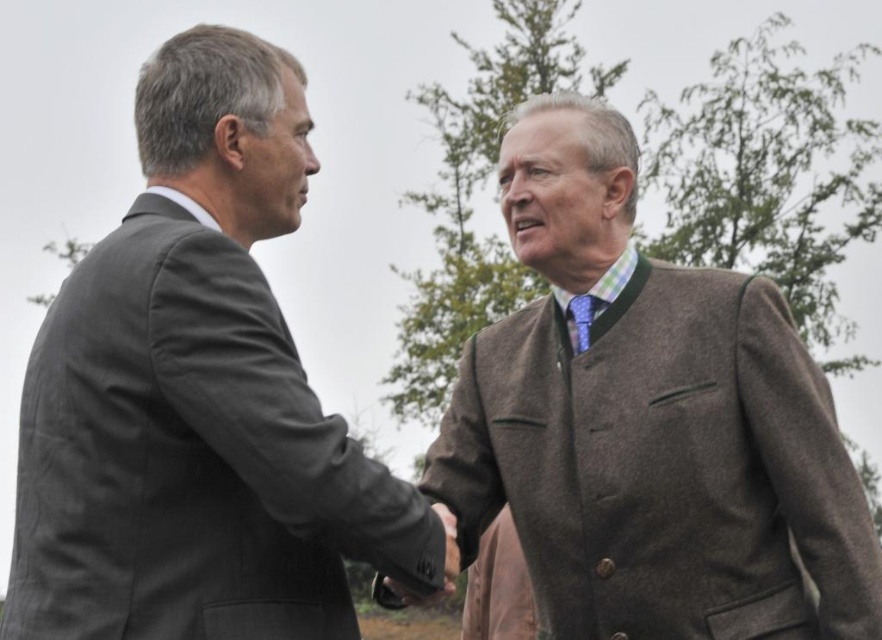
Question: Can you confirm if dark gray suit at left is positioned above brown woolen jacket at center?

Choices:
 (A) no
 (B) yes

Answer: (B)

Question: Among these objects, which one is farthest from the camera?

Choices:
 (A) dark gray suit at left
 (B) brown woolen jacket at center

Answer: (B)

Question: Can you confirm if dark gray suit at left is positioned above smooth leather hand at center?

Choices:
 (A) yes
 (B) no

Answer: (A)

Question: Is brown woolen jacket at center further to the viewer compared to smooth leather hand at center?

Choices:
 (A) no
 (B) yes

Answer: (B)

Question: Which object is positioned farthest from the smooth leather hand at center?

Choices:
 (A) dark gray suit at left
 (B) brown woolen jacket at center

Answer: (B)

Question: Which point appears farthest from the camera in this image?

Choices:
 (A) (443, 516)
 (B) (522, 112)

Answer: (B)